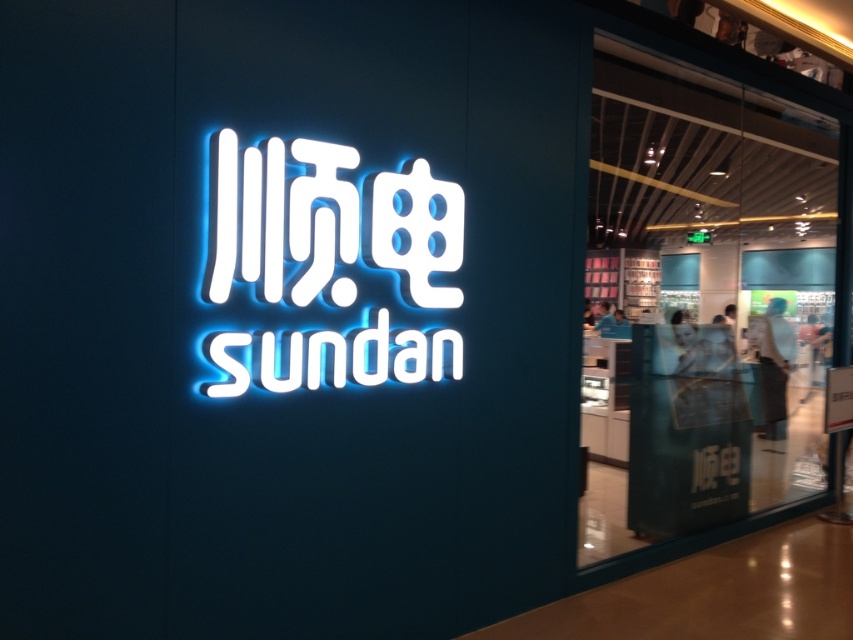
Question: Considering the relative positions of white glossy sign at center and neon white sign at center in the image provided, where is white glossy sign at center located with respect to neon white sign at center?

Choices:
 (A) above
 (B) below

Answer: (B)

Question: Which object appears farthest from the camera in this image?

Choices:
 (A) white glossy sign at center
 (B) neon white sign at center

Answer: (A)

Question: Which of the following is the closest to the observer?

Choices:
 (A) (796, 426)
 (B) (344, 160)

Answer: (B)

Question: Can you confirm if white glossy sign at center is wider than neon white sign at center?

Choices:
 (A) no
 (B) yes

Answer: (B)

Question: Is the position of white glossy sign at center less distant than that of neon white sign at center?

Choices:
 (A) yes
 (B) no

Answer: (B)